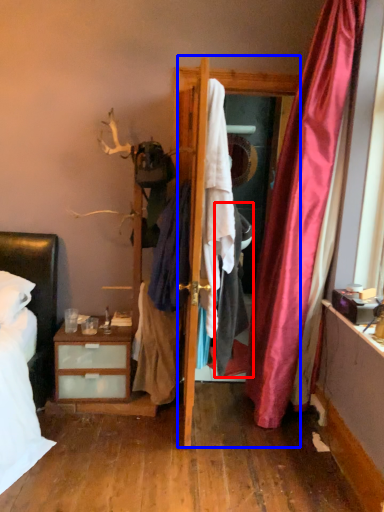
Question: Which point is closer to the camera, clothing (highlighted by a red box) or screen door (highlighted by a blue box)?

Choices:
 (A) clothing
 (B) screen door

Answer: (A)